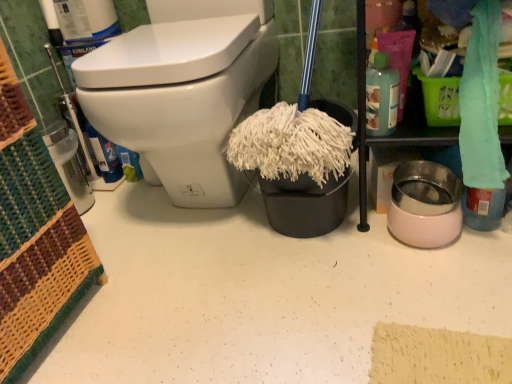
What do you see at coordinates (181, 98) in the screenshot? I see `white glossy toilet at upper left` at bounding box center [181, 98].

What is the approximate height of white glossy toilet at upper left?

white glossy toilet at upper left is 23.08 inches tall.

What do you see at coordinates (361, 107) in the screenshot? This screenshot has height=384, width=512. I see `teal fabric towel at upper right` at bounding box center [361, 107].

Find the location of `white glossy toilet at upper left`. white glossy toilet at upper left is located at coordinates (181, 98).

Is point (148, 73) closer or farther from the camera than point (405, 135)?

Point (148, 73) appears to be closer to the viewer than point (405, 135).

Considering the relative sizes of white glossy toilet at upper left and teal fabric towel at upper right in the image provided, is white glossy toilet at upper left taller than teal fabric towel at upper right?

Yes.

Consider the image. Considering the positions of objects white glossy toilet at upper left and teal fabric towel at upper right in the image provided, who is more to the right, white glossy toilet at upper left or teal fabric towel at upper right?

teal fabric towel at upper right is more to the right.

Is white glossy toilet at upper left in contact with teal fabric towel at upper right?

They are not placed beside each other.

What are the coordinates of `cabinetry in front of the translucent plastic bottle at upper right` in the screenshot? It's located at (361, 107).

Can you confirm if teal fabric towel at upper right is bigger than translucent plastic bottle at upper right?

Indeed, teal fabric towel at upper right has a larger size compared to translucent plastic bottle at upper right.

Would you say translucent plastic bottle at upper right is part of teal fabric towel at upper right's contents?

No, translucent plastic bottle at upper right is located outside of teal fabric towel at upper right.

Which object is wider, teal fabric towel at upper right or translucent plastic bottle at upper right?

teal fabric towel at upper right is wider.

Can you confirm if white glossy toilet at upper left is thinner than white fluffy mop head at center?

Incorrect, the width of white glossy toilet at upper left is not less than that of white fluffy mop head at center.

How different are the orientations of white glossy toilet at upper left and white fluffy mop head at center in degrees?

3.31 degrees.

Based on the photo, is white glossy toilet at upper left facing towards white fluffy mop head at center?

No, white glossy toilet at upper left is not oriented towards white fluffy mop head at center.

Does white glossy toilet at upper left appear on the left side of white fluffy mop head at center?

Yes, white glossy toilet at upper left is to the left of white fluffy mop head at center.

Looking at the image, does teal fabric towel at upper right seem bigger or smaller compared to white glossy toilet at upper left?

Considering their sizes, teal fabric towel at upper right takes up less space than white glossy toilet at upper left.

Considering the positions of objects teal fabric towel at upper right and white glossy toilet at upper left in the image provided, who is more to the left, teal fabric towel at upper right or white glossy toilet at upper left?

white glossy toilet at upper left.

The width and height of the screenshot is (512, 384). Identify the location of toilet to the left of teal fabric towel at upper right. (181, 98).

From a real-world perspective, is teal fabric towel at upper right physically located above or below white glossy toilet at upper left?

teal fabric towel at upper right is situated higher than white glossy toilet at upper left in the real world.

Is the depth of translucent plastic bottle at upper right less than that of teal fabric towel at upper right?

No.

Would you say translucent plastic bottle at upper right is inside or outside teal fabric towel at upper right?

translucent plastic bottle at upper right is not inside teal fabric towel at upper right, it's outside.

Is translucent plastic bottle at upper right directly adjacent to teal fabric towel at upper right?

Yes, translucent plastic bottle at upper right is next to teal fabric towel at upper right.

Is white glossy toilet at upper left facing towards translucent plastic bottle at upper right?

No, white glossy toilet at upper left is not facing towards translucent plastic bottle at upper right.

Does point (101, 52) come farther from viewer compared to point (370, 91)?

Yes, point (101, 52) is behind point (370, 91).

Locate an element on the screen. The image size is (512, 384). toilet lying on the left of translucent plastic bottle at upper right is located at coordinates (181, 98).

Are white glossy toilet at upper left and translucent plastic bottle at upper right located far from each other?

No, white glossy toilet at upper left is in close proximity to translucent plastic bottle at upper right.

Considering the sizes of objects white fluffy mop head at center and white glossy toilet at upper left in the image provided, who is taller, white fluffy mop head at center or white glossy toilet at upper left?

white glossy toilet at upper left is taller.

Which point is more distant from viewer, (268, 180) or (120, 75)?

The point (268, 180) is more distant.

Looking at this image, from the image's perspective, is white fluffy mop head at center above or below white glossy toilet at upper left?

white fluffy mop head at center is below white glossy toilet at upper left.

At what (x,y) coordinates should I click in order to perform the action: click on toilet above the teal fabric towel at upper right (from the image's perspective). Please return your answer as a coordinate pair (x, y). Looking at the image, I should click on click(x=181, y=98).

I want to click on cabinetry that is in front of the translucent plastic bottle at upper right, so click(361, 107).

When comparing their distances from teal fabric towel at upper right, does white glossy toilet at upper left or translucent plastic bottle at upper right seem further?

white glossy toilet at upper left is positioned further to the anchor teal fabric towel at upper right.

Based on their spatial positions, is teal fabric towel at upper right or white glossy toilet at upper left further from translucent plastic bottle at upper right?

Among the two, white glossy toilet at upper left is located further to translucent plastic bottle at upper right.

Estimate the real-world distances between objects in this image. Which object is closer to white fluffy mop head at center, teal fabric towel at upper right or translucent plastic bottle at upper right?

Among the two, translucent plastic bottle at upper right is located nearer to white fluffy mop head at center.

Which object lies further to the anchor point white glossy toilet at upper left, teal fabric towel at upper right or white fluffy mop head at center?

Among the two, teal fabric towel at upper right is located further to white glossy toilet at upper left.

Considering their positions, is white fluffy mop head at center positioned further to translucent plastic bottle at upper right than white glossy toilet at upper left?

Based on the image, white glossy toilet at upper left appears to be further to translucent plastic bottle at upper right.

When comparing their distances from translucent plastic bottle at upper right, does white glossy toilet at upper left or teal fabric towel at upper right seem closer?

The object closer to translucent plastic bottle at upper right is teal fabric towel at upper right.

Based on their spatial positions, is white glossy toilet at upper left or white fluffy mop head at center closer to teal fabric towel at upper right?

Based on the image, white fluffy mop head at center appears to be nearer to teal fabric towel at upper right.

From the image, which object appears to be nearer to white fluffy mop head at center, teal fabric towel at upper right or white glossy toilet at upper left?

teal fabric towel at upper right is positioned closer to the anchor white fluffy mop head at center.

This screenshot has width=512, height=384. Identify the location of debris between white glossy toilet at upper left and teal fabric towel at upper right. (295, 146).

Find the location of a particular element. This screenshot has width=512, height=384. debris between white glossy toilet at upper left and translucent plastic bottle at upper right from left to right is located at coordinates (295, 146).

I want to click on cleaning product between white fluffy mop head at center and teal fabric towel at upper right in the horizontal direction, so click(381, 96).

Where is `cleaning product between white glossy toilet at upper left and teal fabric towel at upper right`? This screenshot has width=512, height=384. cleaning product between white glossy toilet at upper left and teal fabric towel at upper right is located at coordinates (381, 96).